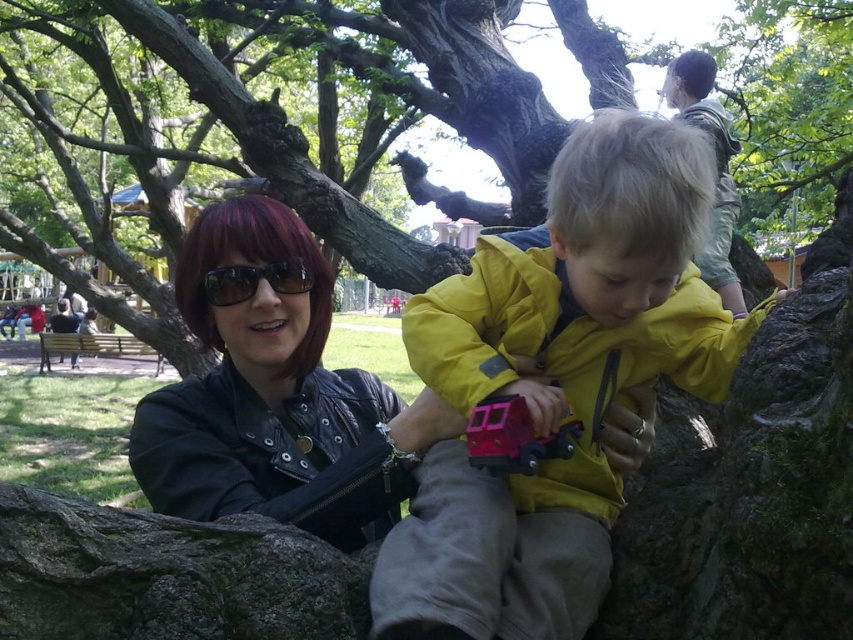
Question: Which is nearer to the green mossy rock at lower left?

Choices:
 (A) yellow matte jacket at center
 (B) light brown fabric jacket at upper right

Answer: (A)

Question: Can you confirm if black leather jacket at center is positioned to the right of black plastic sunglasses at upper center?

Choices:
 (A) no
 (B) yes

Answer: (B)

Question: Which point is closer to the camera taking this photo?

Choices:
 (A) (82, 589)
 (B) (299, 285)
 (C) (496, 29)
 (D) (585, 492)

Answer: (A)

Question: Can you confirm if light brown fabric jacket at upper right is wider than rubberized red train at center?

Choices:
 (A) yes
 (B) no

Answer: (A)

Question: Does rough bark tree at center lie behind light brown fabric jacket at upper right?

Choices:
 (A) no
 (B) yes

Answer: (B)

Question: Among these objects, which one is nearest to the camera?

Choices:
 (A) green mossy rock at lower left
 (B) light brown fabric jacket at upper right

Answer: (A)